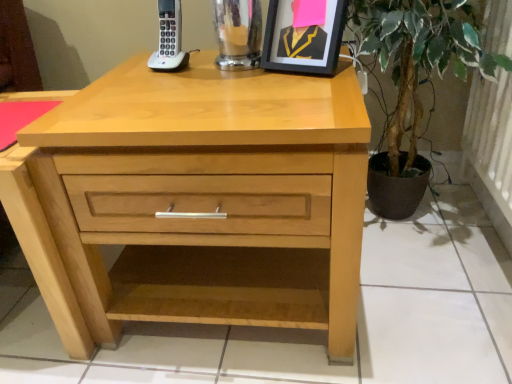
Question: In the image, is natural wood chest of drawers at center on the left side or the right side of black matte picture frame at upper center?

Choices:
 (A) left
 (B) right

Answer: (A)

Question: Is natural wood chest of drawers at center wider or thinner than black matte picture frame at upper center?

Choices:
 (A) thin
 (B) wide

Answer: (B)

Question: Which of these objects is positioned farthest from the natural wood chest of drawers at center?

Choices:
 (A) black matte picture frame at upper center
 (B) green leafy plant at right

Answer: (B)

Question: Which object is positioned closest to the natural wood chest of drawers at center?

Choices:
 (A) black matte picture frame at upper center
 (B) green leafy plant at right

Answer: (A)